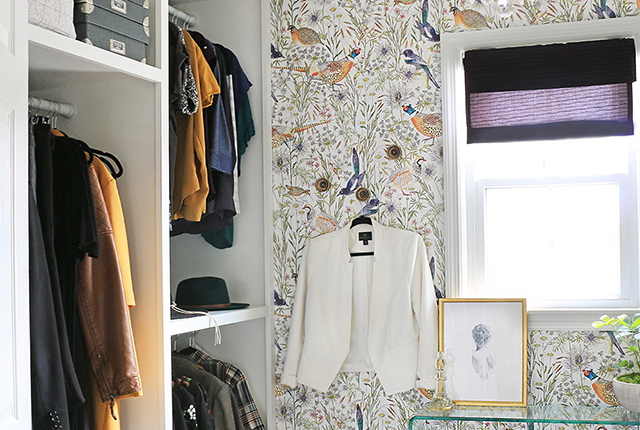
Locate an element on the screen. blind is located at coordinates (518, 75).